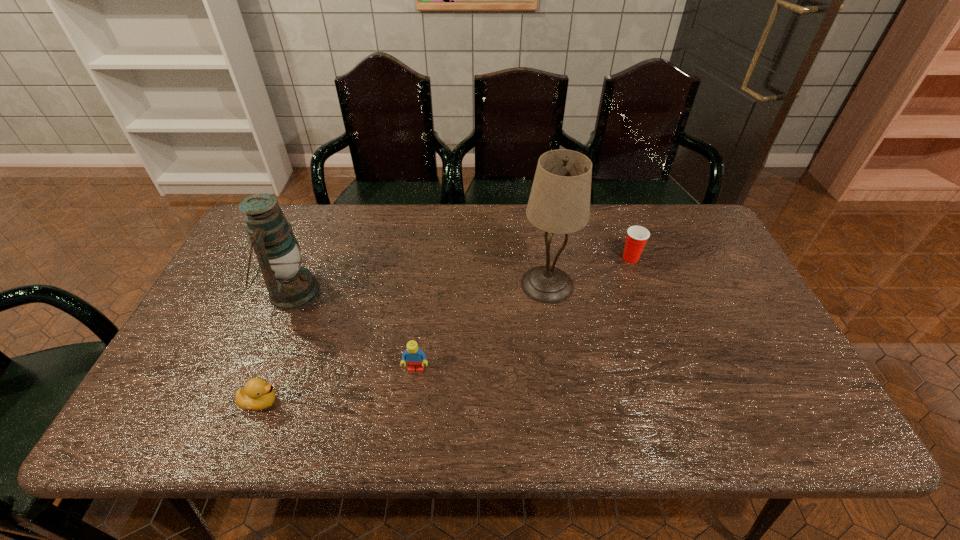
At what (x,y) coordinates should I click in order to perform the action: click on the tallest object. Please return your answer as a coordinate pair (x, y). The image size is (960, 540). Looking at the image, I should click on click(559, 203).

You are a GUI agent. You are given a task and a screenshot of the screen. Output one action in this format:
    pyautogui.click(x=<x>, y=<y>)
    Task: Click on the lampshade
    
    Given the screenshot: What is the action you would take?
    pyautogui.click(x=559, y=203)

The image size is (960, 540). I want to click on the fourth shortest object, so click(x=291, y=286).

This screenshot has height=540, width=960. What are the coordinates of `the farthest object` in the screenshot? It's located at (637, 236).

This screenshot has height=540, width=960. Identify the location of the rightmost object. (637, 236).

Locate an element on the screen. This screenshot has width=960, height=540. the third object from left to right is located at coordinates (415, 358).

Where is `Lego`? This screenshot has width=960, height=540. Lego is located at coordinates (415, 358).

In order to click on the shortest object in this screenshot , I will do `click(256, 395)`.

Image resolution: width=960 pixels, height=540 pixels. Identify the location of the nearest object. (256, 395).

Where is `vacant area located on the front-facing side of the fourth object from left to right`? vacant area located on the front-facing side of the fourth object from left to right is located at coordinates (560, 366).